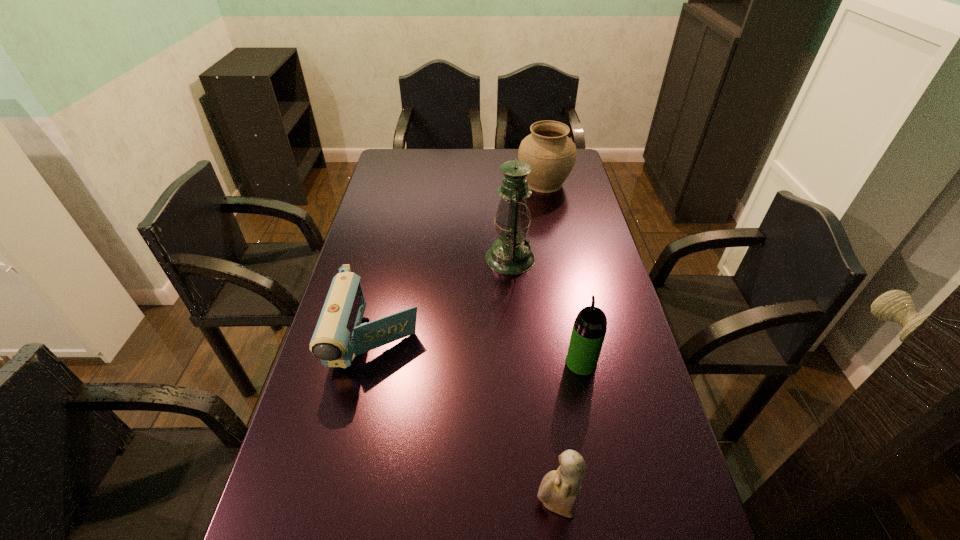
I want to click on oil lamp, so click(510, 254).

This screenshot has height=540, width=960. What are the coordinates of `the fourth nearest object` in the screenshot? It's located at (510, 254).

Locate an element on the screen. This screenshot has height=540, width=960. the farthest object is located at coordinates (551, 154).

Identify the location of figurine. (559, 490).

Locate an element on the screen. This screenshot has width=960, height=540. thermos bottle is located at coordinates [589, 329].

Locate an element on the screen. This screenshot has width=960, height=540. the leftmost object is located at coordinates (339, 336).

This screenshot has width=960, height=540. Find the location of `camcorder`. camcorder is located at coordinates (339, 336).

Locate an element on the screen. Image resolution: width=960 pixels, height=540 pixels. vacant space located 0.070m on the right of the tallest object is located at coordinates (557, 258).

This screenshot has width=960, height=540. I want to click on vacant space located 0.200m on the left of the urn, so click(467, 183).

Identify the location of vacant space located 0.200m on the front-facing side of the figurine. This screenshot has width=960, height=540. (435, 504).